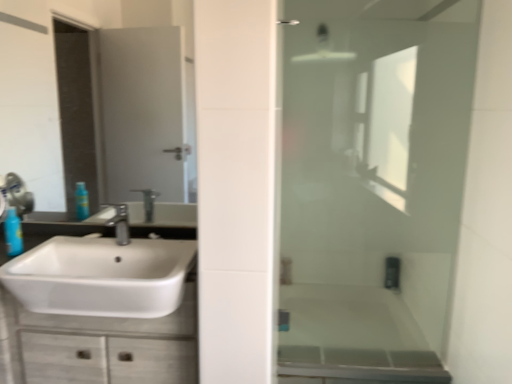
Question: Is white glossy sink at left smaller than satin nickel faucet at center?

Choices:
 (A) yes
 (B) no

Answer: (B)

Question: Would you say white glossy sink at left is outside satin nickel faucet at center?

Choices:
 (A) yes
 (B) no

Answer: (A)

Question: Could you tell me if white glossy sink at left is facing satin nickel faucet at center?

Choices:
 (A) yes
 (B) no

Answer: (B)

Question: Does white glossy sink at left have a lesser height compared to satin nickel faucet at center?

Choices:
 (A) yes
 (B) no

Answer: (B)

Question: Is white glossy sink at left taller than satin nickel faucet at center?

Choices:
 (A) yes
 (B) no

Answer: (A)

Question: From their relative heights in the image, would you say white glossy cabinet at lower left is taller or shorter than satin nickel faucet at center?

Choices:
 (A) short
 (B) tall

Answer: (B)

Question: From the image's perspective, relative to satin nickel faucet at center, is white glossy cabinet at lower left above or below?

Choices:
 (A) below
 (B) above

Answer: (A)

Question: In terms of size, does white glossy cabinet at lower left appear bigger or smaller than satin nickel faucet at center?

Choices:
 (A) small
 (B) big

Answer: (B)

Question: Is white glossy cabinet at lower left inside the boundaries of satin nickel faucet at center, or outside?

Choices:
 (A) outside
 (B) inside

Answer: (A)

Question: Is transparent glass shower door at right inside or outside of translucent plastic bottle at left?

Choices:
 (A) inside
 (B) outside

Answer: (B)

Question: From the image's perspective, is transparent glass shower door at right above or below translucent plastic bottle at left?

Choices:
 (A) above
 (B) below

Answer: (A)

Question: Looking at their shapes, would you say transparent glass shower door at right is wider or thinner than translucent plastic bottle at left?

Choices:
 (A) thin
 (B) wide

Answer: (A)

Question: Is point (288, 122) closer or farther from the camera than point (11, 215)?

Choices:
 (A) farther
 (B) closer

Answer: (A)

Question: From a real-world perspective, is white glossy cabinet at lower left positioned above or below translucent plastic bottle at left?

Choices:
 (A) below
 (B) above

Answer: (A)

Question: Looking at their shapes, would you say white glossy cabinet at lower left is wider or thinner than translucent plastic bottle at left?

Choices:
 (A) wide
 (B) thin

Answer: (A)